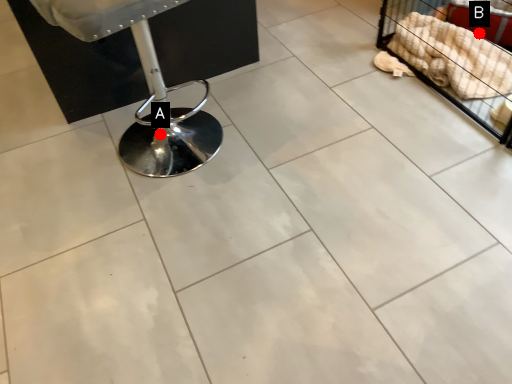
Question: Two points are circled on the image, labeled by A and B beside each circle. Which point is further to the camera?

Choices:
 (A) A is further
 (B) B is further

Answer: (B)